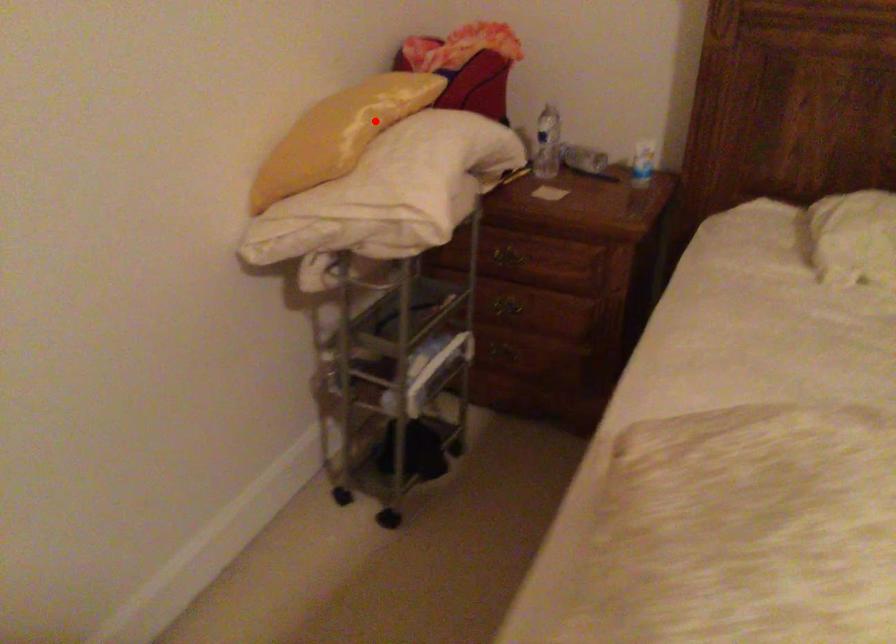
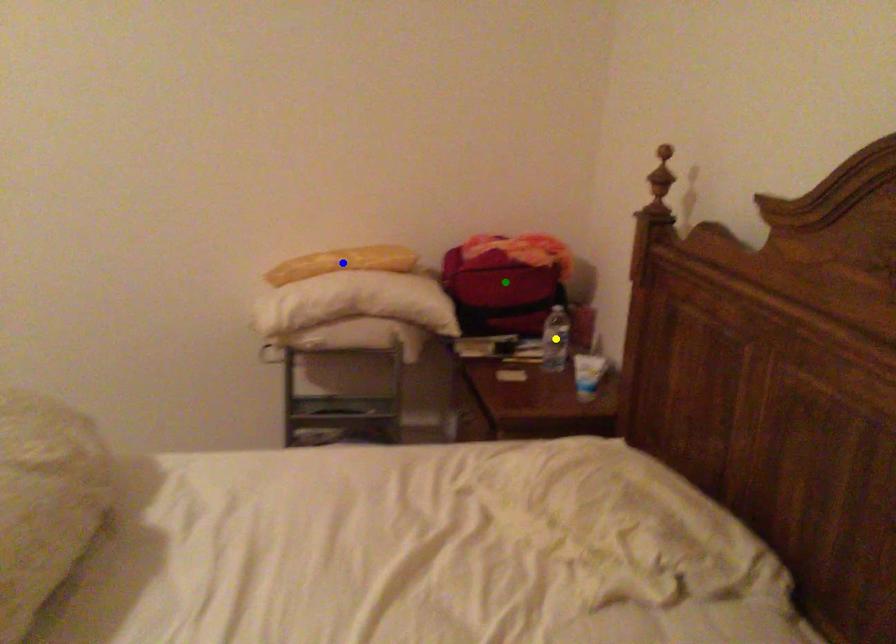
Question: I am providing you with two images of the same scene from different viewpoints. A red point is marked on the first image. You are given multiple points on the second image. Which spot in image 2 lines up with the point in image 1?

Choices:
 (A) green point
 (B) yellow point
 (C) blue point

Answer: (C)